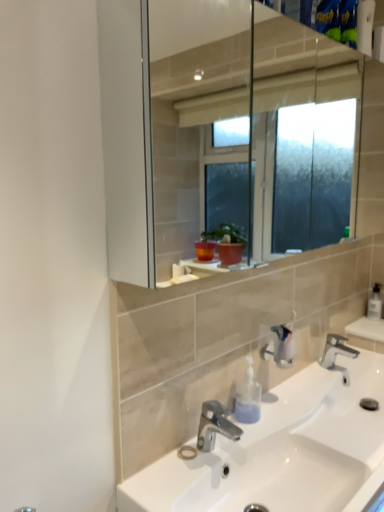
Question: Considering the relative sizes of polished chrome faucet at lower center, which is the second tap in front-to-back order, and white ceramic sink at center in the image provided, is polished chrome faucet at lower center, which is the second tap in front-to-back order, bigger than white ceramic sink at center?

Choices:
 (A) no
 (B) yes

Answer: (A)

Question: Is white ceramic sink at center located within polished chrome faucet at lower center, positioned as the 1th tap in right-to-left order?

Choices:
 (A) no
 (B) yes

Answer: (A)

Question: Is polished chrome faucet at lower center, acting as the second tap starting from the left, thinner than white ceramic sink at center?

Choices:
 (A) yes
 (B) no

Answer: (A)

Question: Is polished chrome faucet at lower center, which is the second tap in front-to-back order, behind white ceramic sink at center?

Choices:
 (A) yes
 (B) no

Answer: (A)

Question: From the image's perspective, is polished chrome faucet at lower center, acting as the second tap starting from the left, located beneath white ceramic sink at center?

Choices:
 (A) no
 (B) yes

Answer: (A)

Question: From a real-world perspective, is translucent plastic soap dispenser at lower center, arranged as the 2th soap dispenser when viewed from the back, physically located above or below white ceramic sink at center?

Choices:
 (A) below
 (B) above

Answer: (B)

Question: Is point (244, 416) positioned closer to the camera than point (306, 424)?

Choices:
 (A) farther
 (B) closer

Answer: (B)

Question: In the image, is translucent plastic soap dispenser at lower center, arranged as the 2th soap dispenser when viewed from the back, positioned in front of or behind white ceramic sink at center?

Choices:
 (A) front
 (B) behind

Answer: (B)

Question: Would you say translucent plastic soap dispenser at lower center, the 2th soap dispenser viewed from the right, is to the left or to the right of white ceramic sink at center in the picture?

Choices:
 (A) right
 (B) left

Answer: (B)

Question: Looking at their shapes, would you say polished chrome faucet at center, acting as the 2th tap starting from the back, is wider or thinner than polished chrome faucet at lower center, which is the first tap from back to front?

Choices:
 (A) wide
 (B) thin

Answer: (B)

Question: From a real-world perspective, is polished chrome faucet at center, acting as the first tap starting from the left, positioned above or below polished chrome faucet at lower center, which is the first tap from back to front?

Choices:
 (A) above
 (B) below

Answer: (A)

Question: Is polished chrome faucet at center, which appears as the 2th tap when viewed from the right, bigger or smaller than polished chrome faucet at lower center, which is the first tap from back to front?

Choices:
 (A) big
 (B) small

Answer: (B)

Question: Relative to polished chrome faucet at lower center, positioned as the 1th tap in right-to-left order, is polished chrome faucet at center, acting as the 2th tap starting from the back, in front or behind?

Choices:
 (A) front
 (B) behind

Answer: (A)

Question: Would you say clear plastic soap dispenser at right, which is counted as the second soap dispenser, starting from the front, is inside or outside white ceramic sink at center?

Choices:
 (A) outside
 (B) inside

Answer: (A)

Question: In terms of width, does clear plastic soap dispenser at right, which is counted as the second soap dispenser, starting from the front, look wider or thinner when compared to white ceramic sink at center?

Choices:
 (A) thin
 (B) wide

Answer: (A)